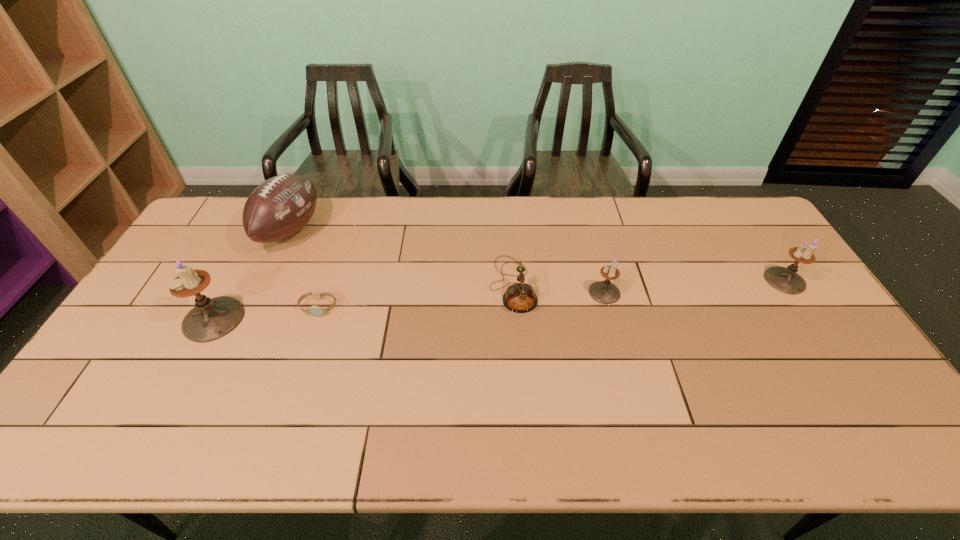
At what (x,y) coordinates should I click in order to perform the action: click on the tallest object. Please return your answer as a coordinate pair (x, y). The height and width of the screenshot is (540, 960). Looking at the image, I should click on (210, 319).

The height and width of the screenshot is (540, 960). Identify the location of the tallest candle holder. (210, 319).

The image size is (960, 540). What are the coordinates of `the third shortest object` in the screenshot? It's located at (605, 292).

Image resolution: width=960 pixels, height=540 pixels. I want to click on the second candle holder from left to right, so click(605, 292).

At what (x,y) coordinates should I click in order to perform the action: click on the rightmost candle holder. Please return your answer as a coordinate pair (x, y). Looking at the image, I should click on [786, 280].

What are the coordinates of `the rightmost object` in the screenshot? It's located at (786, 280).

This screenshot has height=540, width=960. I want to click on football (American), so click(281, 206).

The image size is (960, 540). I want to click on watch, so click(x=314, y=310).

Where is `the fourth object from right to left`? The height and width of the screenshot is (540, 960). the fourth object from right to left is located at coordinates (314, 310).

I want to click on telephone, so click(520, 297).